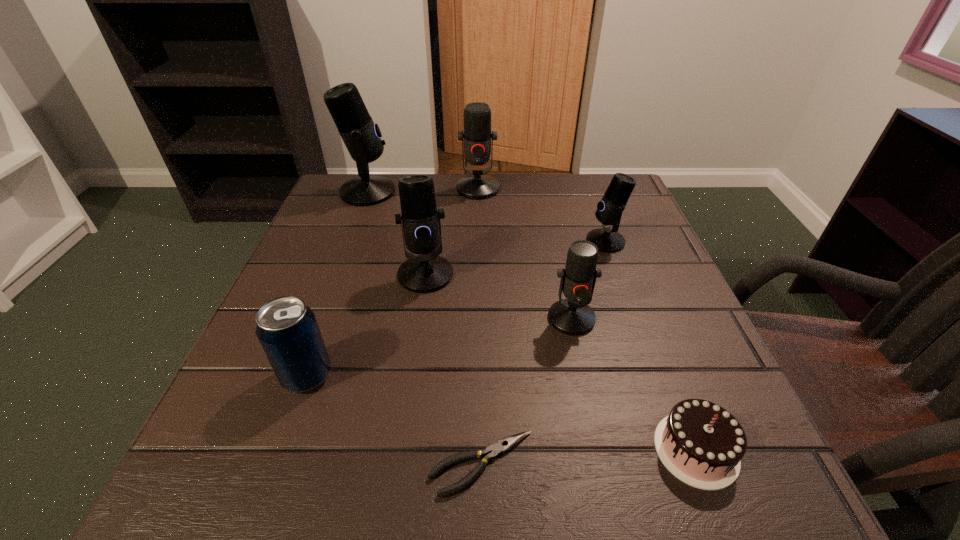
This screenshot has width=960, height=540. What are the coordinates of `the sixth farthest object` in the screenshot? It's located at (287, 329).

This screenshot has width=960, height=540. In order to click on the seventh tallest object in this screenshot , I will do `click(702, 444)`.

Locate an element on the screen. This screenshot has width=960, height=540. pliers is located at coordinates (503, 445).

You are a GUI agent. You are given a task and a screenshot of the screen. Output one action in this format:
    pyautogui.click(x=<x>, y=<y>)
    Task: Click on the vacant region located on the stand of the leftmost black microphone
    
    Given the screenshot: What is the action you would take?
    pyautogui.click(x=533, y=192)

Image resolution: width=960 pixels, height=540 pixels. In order to click on free location located 0.300m on the stand of the fifth nearest object in this screenshot , I will do `click(402, 436)`.

At what (x,y) coordinates should I click in order to perform the action: click on blank space located on the side of the left red microphone with the red ring. Please return your answer as a coordinate pair (x, y). The width and height of the screenshot is (960, 540). Looking at the image, I should click on (478, 274).

Identify the location of vacant space situated on the stand of the third farthest object. (560, 241).

You are a GUI agent. You are given a task and a screenshot of the screen. Output one action in this format:
    pyautogui.click(x=<x>, y=<y>)
    Task: Click on the vacant space located 0.170m on the stand of the third farthest object
    Image resolution: width=960 pixels, height=540 pixels.
    Given the screenshot: What is the action you would take?
    pos(511,241)

This screenshot has height=540, width=960. In order to click on free space located 0.390m on the stand of the third farthest object in this screenshot , I will do `click(412, 241)`.

This screenshot has width=960, height=540. I want to click on vacant space located on the side of the nearest microphone with the red ring, so click(591, 411).